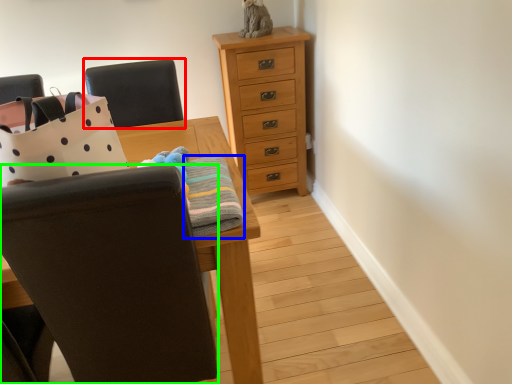
Question: Estimate the real-world distances between objects in this image. Which object is farther from chair (highlighted by a red box), blanket (highlighted by a blue box) or chair (highlighted by a green box)?

Choices:
 (A) blanket
 (B) chair

Answer: (B)